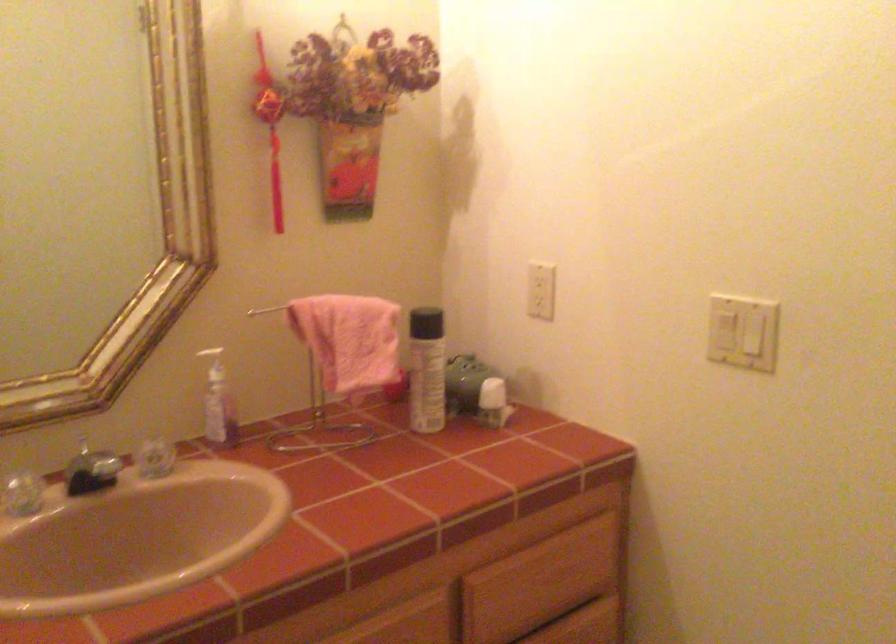
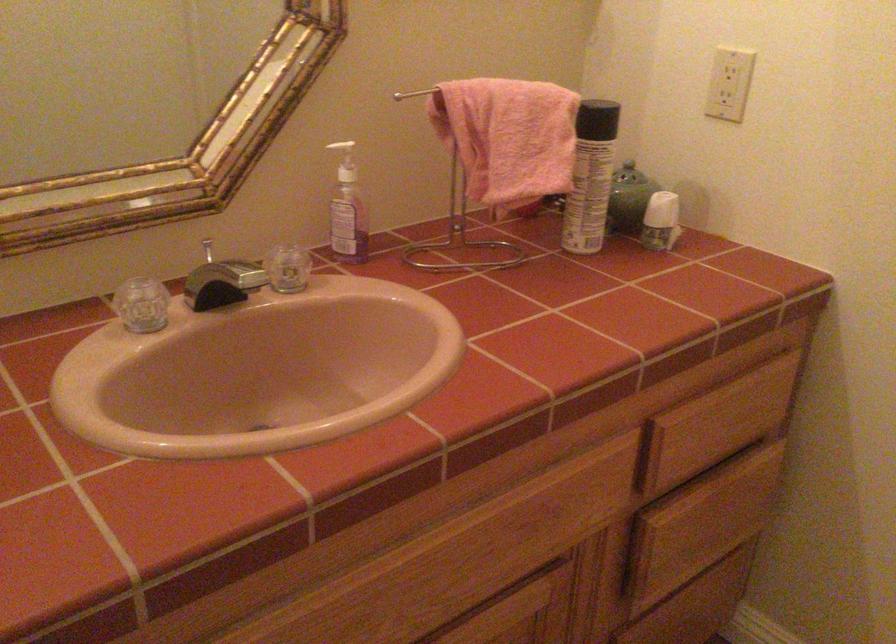
The point at (424, 371) is marked in the first image. Where is the corresponding point in the second image?

(590, 176)